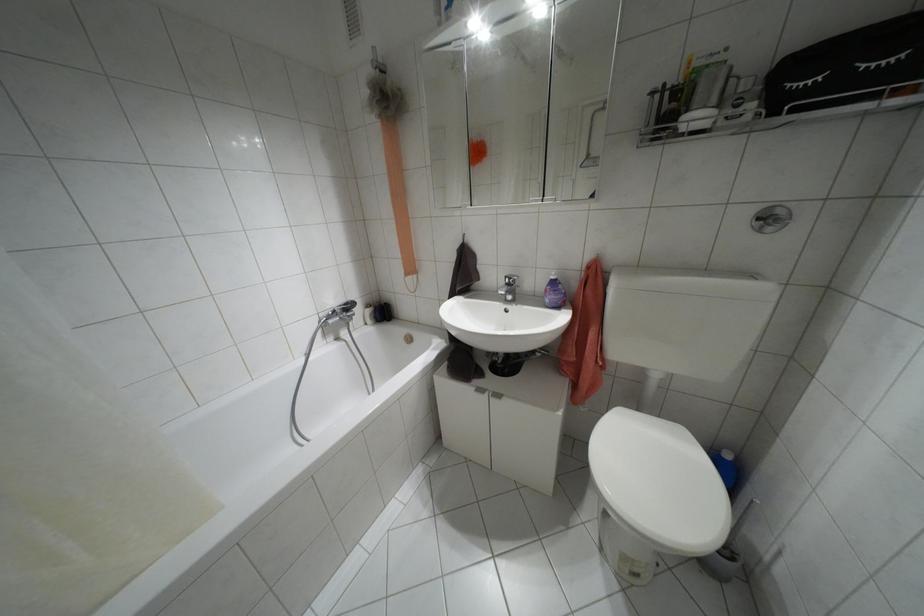
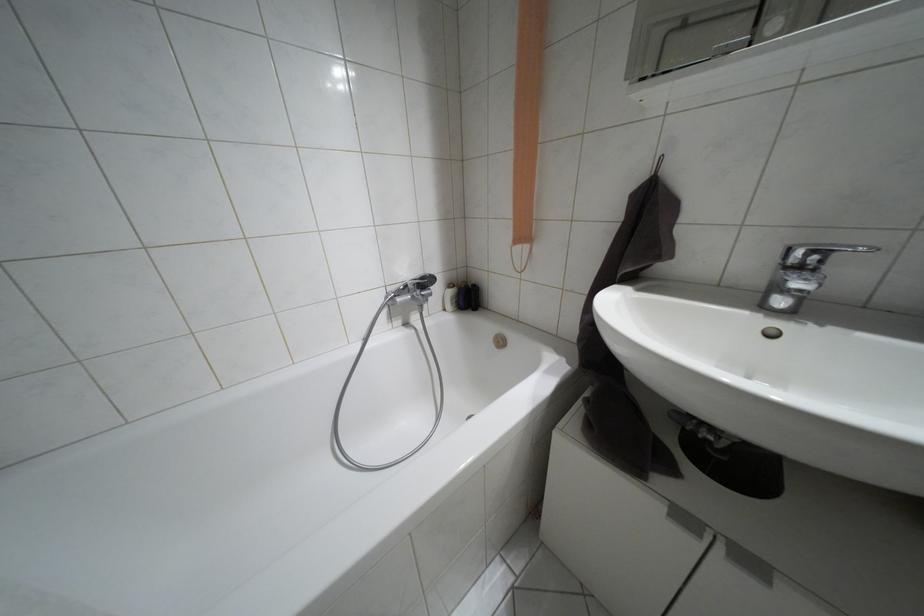
Where in the second image is the point corresponding to the point at 480,390 from the first image?

(684, 517)